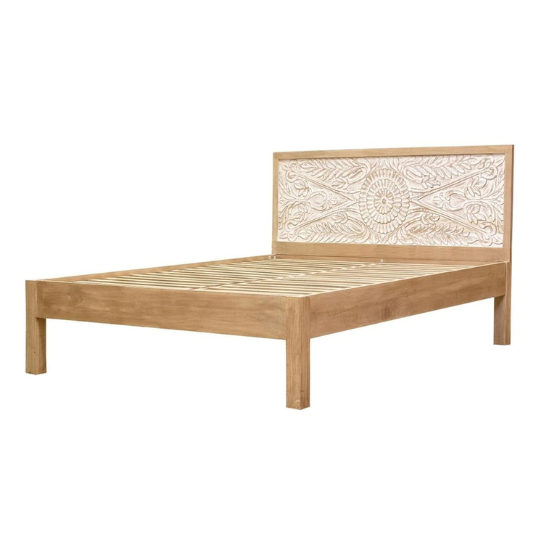
You are a GUI agent. You are given a task and a screenshot of the screen. Output one action in this format:
    pyautogui.click(x=<x>, y=<y>)
    Task: Click on the bed
    
    Given the screenshot: What is the action you would take?
    point(300,280)